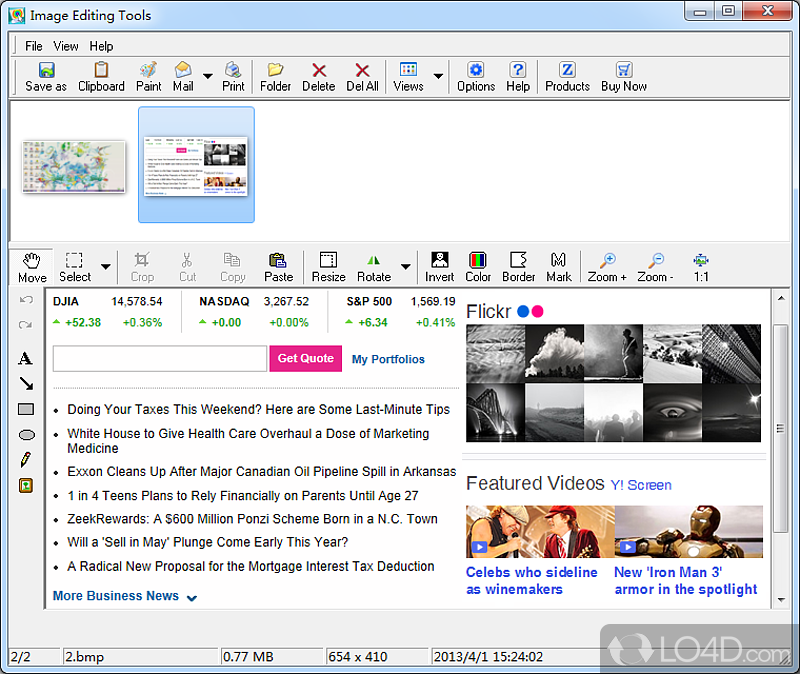
The image size is (800, 674). In order to click on b&w photos in this screenshot , I will do `click(510, 342)`, `click(568, 346)`, `click(610, 352)`, `click(669, 354)`, `click(726, 356)`, `click(726, 406)`, `click(682, 414)`, `click(614, 419)`, `click(545, 425)`, `click(490, 425)`.